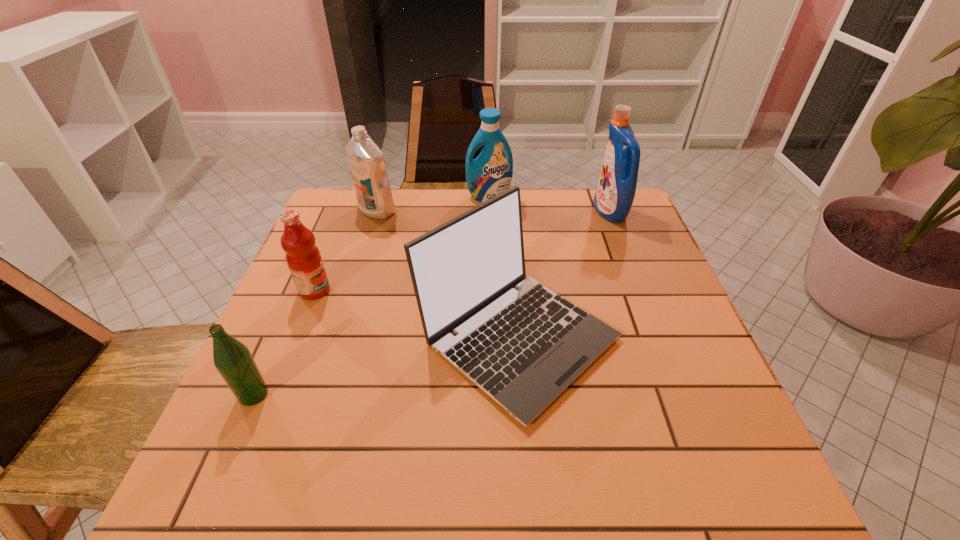
Where is `vacant space situated on the front of the leftmost detergent`? This screenshot has width=960, height=540. vacant space situated on the front of the leftmost detergent is located at coordinates (358, 269).

Where is `free location located at the front screen of the laptop_computer`? This screenshot has width=960, height=540. free location located at the front screen of the laptop_computer is located at coordinates (528, 465).

This screenshot has height=540, width=960. In order to click on vacant area situated on the front label of the fruit juice in this screenshot , I will do `click(470, 291)`.

I want to click on free space located 0.290m on the back of the bottle, so click(303, 280).

You are a GUI agent. You are given a task and a screenshot of the screen. Output one action in this format:
    pyautogui.click(x=<x>, y=<y>)
    Task: Click on the detergent at the left edge
    This screenshot has height=540, width=960.
    Given the screenshot: What is the action you would take?
    pyautogui.click(x=365, y=159)

Find the location of `fruit juice that is at the left edge`. fruit juice that is at the left edge is located at coordinates (303, 257).

Where is `bottle present at the left edge`? This screenshot has width=960, height=540. bottle present at the left edge is located at coordinates (233, 360).

You are a GUI agent. You are given a task and a screenshot of the screen. Output one action in this format:
    pyautogui.click(x=<x>, y=<y>)
    Task: Click on the detergent that is at the right edge
    
    Given the screenshot: What is the action you would take?
    click(615, 192)

Locate an element on the screen. The width and height of the screenshot is (960, 540). laptop_computer located in the right edge section of the desktop is located at coordinates (523, 348).

This screenshot has height=540, width=960. What are the coordinates of `object located at the far left corner` in the screenshot? It's located at (365, 159).